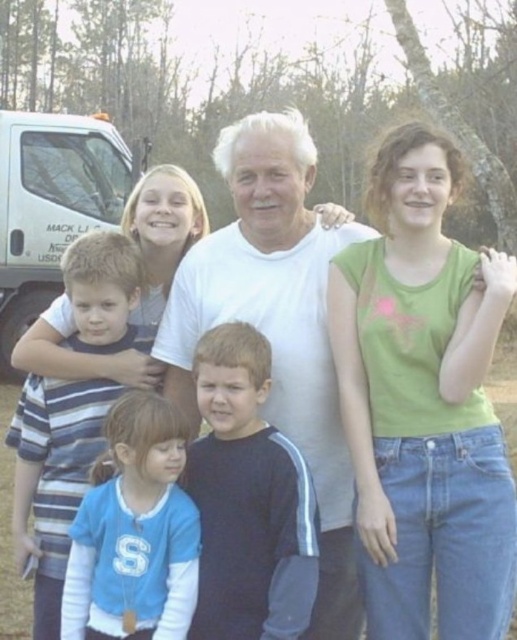
Which is behind, point (250, 451) or point (38, 376)?

Positioned behind is point (38, 376).

Can you confirm if black fleece at center is positioned below striped cotton shirt at left?

Yes.

What do you see at coordinates (248, 499) in the screenshot?
I see `black fleece at center` at bounding box center [248, 499].

Locate an element on the screen. The width and height of the screenshot is (517, 640). black fleece at center is located at coordinates (248, 499).

Who is lower down, green cotton shirt at right or blue fleece jacket at lower left?

Positioned lower is blue fleece jacket at lower left.

Which is in front, point (510, 516) or point (131, 589)?

Point (131, 589) is in front.

Does point (413, 216) come farther from viewer compared to point (187, 616)?

Yes.

This screenshot has width=517, height=640. Find the location of `green cotton shirt at right`. green cotton shirt at right is located at coordinates (423, 403).

The image size is (517, 640). Find the location of `white matte shirt at center`. white matte shirt at center is located at coordinates (277, 324).

Can you confirm if white matte shirt at center is wider than blue fleece jacket at lower left?

Yes.

Is point (341, 426) positioned before point (93, 593)?

No, it is not.

This screenshot has height=640, width=517. Find the location of `white matte shirt at center`. white matte shirt at center is located at coordinates pyautogui.click(x=277, y=324).